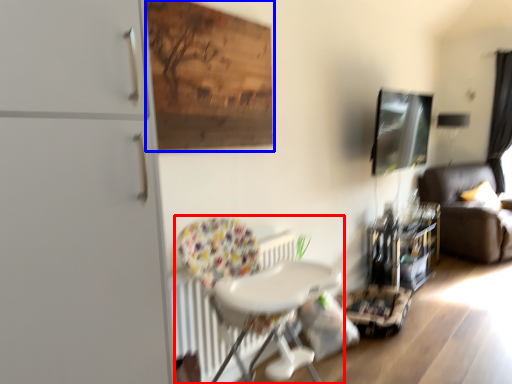
Question: Which object is further to the camera taking this photo, chair (highlighted by a red box) or plywood (highlighted by a blue box)?

Choices:
 (A) chair
 (B) plywood

Answer: (B)